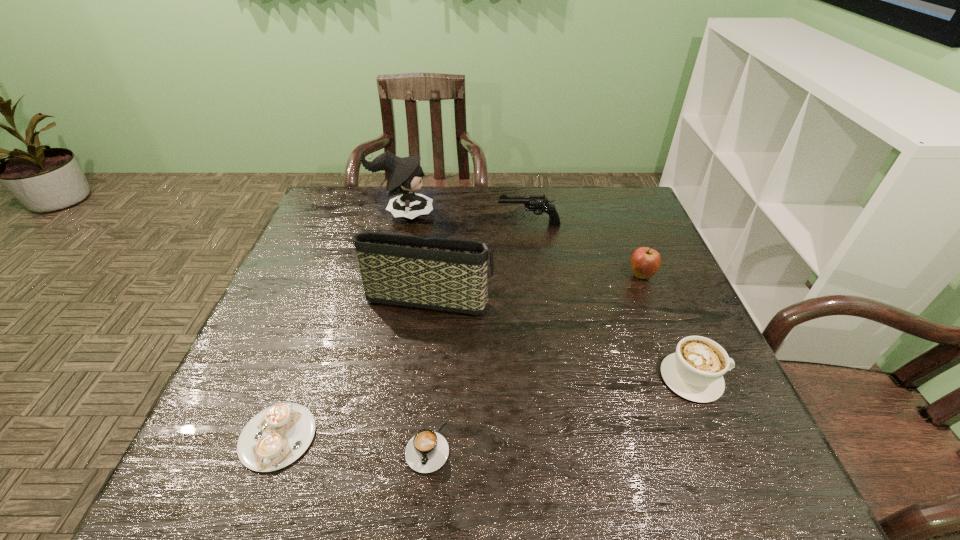
The height and width of the screenshot is (540, 960). What are the coordinates of `doll` in the screenshot? It's located at (405, 175).

This screenshot has width=960, height=540. Identify the location of handbag. (443, 274).

What are the coordinates of `the fifth object from left to right` in the screenshot? It's located at (534, 203).

In order to click on apple in this screenshot , I will do `click(645, 262)`.

This screenshot has height=540, width=960. In order to click on the third shortest object in this screenshot , I will do `click(695, 372)`.

Find the location of a particular element. The image size is (960, 540). the tallest cappuccino is located at coordinates (695, 372).

The width and height of the screenshot is (960, 540). What are the coordinates of `the second shortest cappuccino` in the screenshot? It's located at (427, 451).

The image size is (960, 540). Identify the location of the sixth tallest object. (427, 451).

The height and width of the screenshot is (540, 960). In order to click on the shortest object in this screenshot , I will do `click(277, 436)`.

In order to click on the leftmost cappuccino in this screenshot , I will do `click(277, 436)`.